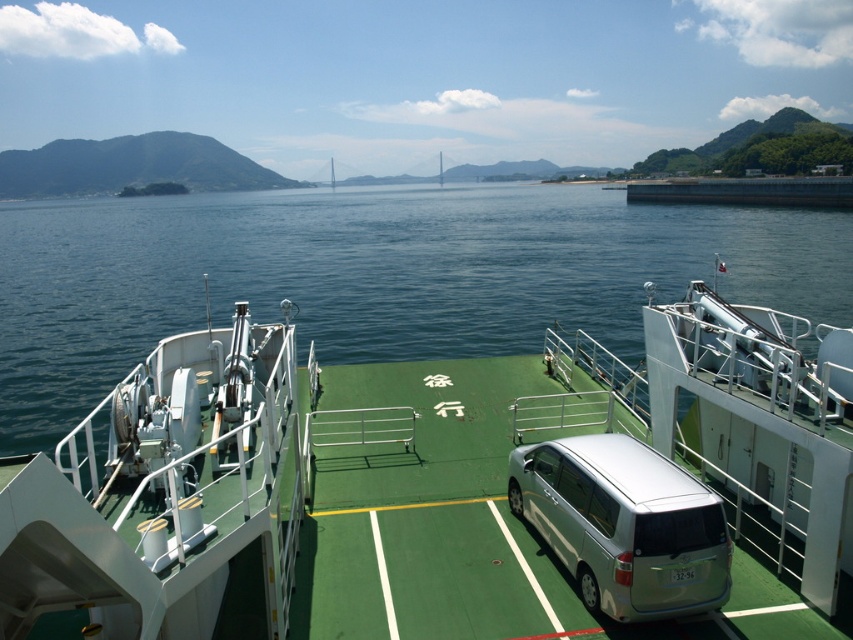
Question: Which of the following is the closest to the observer?

Choices:
 (A) (799, 342)
 (B) (724, 520)

Answer: (B)

Question: Which of the following is the farthest from the observer?

Choices:
 (A) green water at center
 (B) green rubber boat at center
 (C) silver metallic van at center

Answer: (A)

Question: Is green rubber boat at center closer to the viewer compared to silver metallic van at center?

Choices:
 (A) yes
 (B) no

Answer: (A)

Question: Is green water at center to the left of silver metallic van at center from the viewer's perspective?

Choices:
 (A) no
 (B) yes

Answer: (B)

Question: In this image, where is green water at center located relative to silver metallic van at center?

Choices:
 (A) above
 (B) below

Answer: (A)

Question: Which of the following is the farthest from the observer?

Choices:
 (A) green rubber boat at center
 (B) green water at center

Answer: (B)